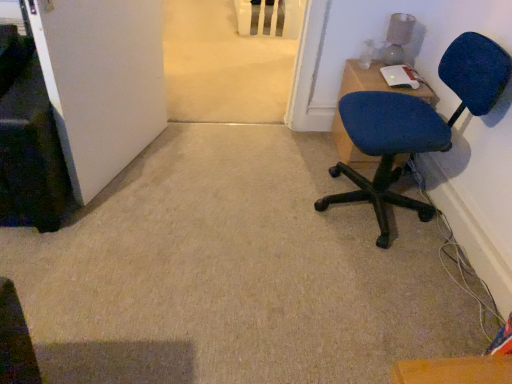
Where is `vacant space underneath blue fabric chair at right (from a real-world perspective)`? This screenshot has height=384, width=512. vacant space underneath blue fabric chair at right (from a real-world perspective) is located at coordinates (374, 211).